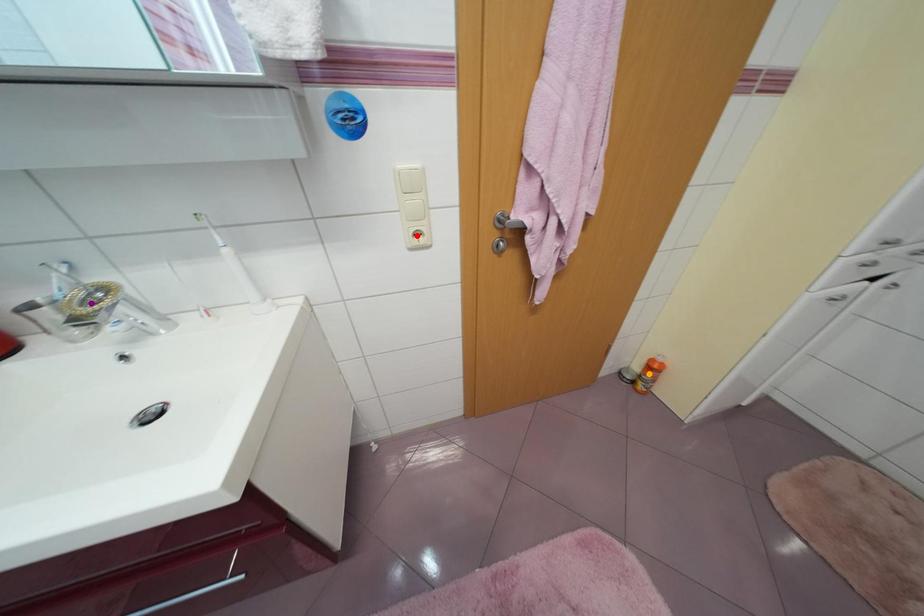
In the scene shown: Order these from nearest to farthest:
orange point, red point, purple point

purple point, red point, orange point